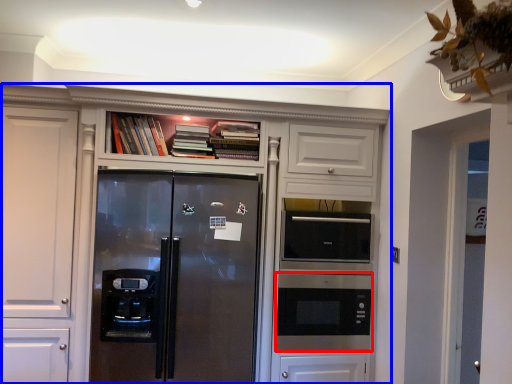
Question: Among these objects, which one is nearest to the camera, microwave oven (highlighted by a red box) or cupboard (highlighted by a blue box)?

Choices:
 (A) microwave oven
 (B) cupboard

Answer: (B)